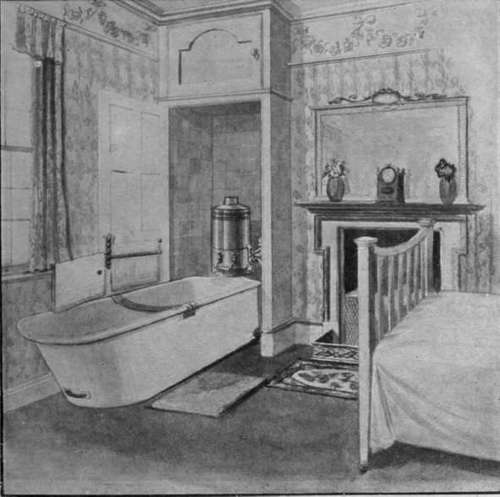
The height and width of the screenshot is (497, 500). Identify the location of curtain. 43,179.